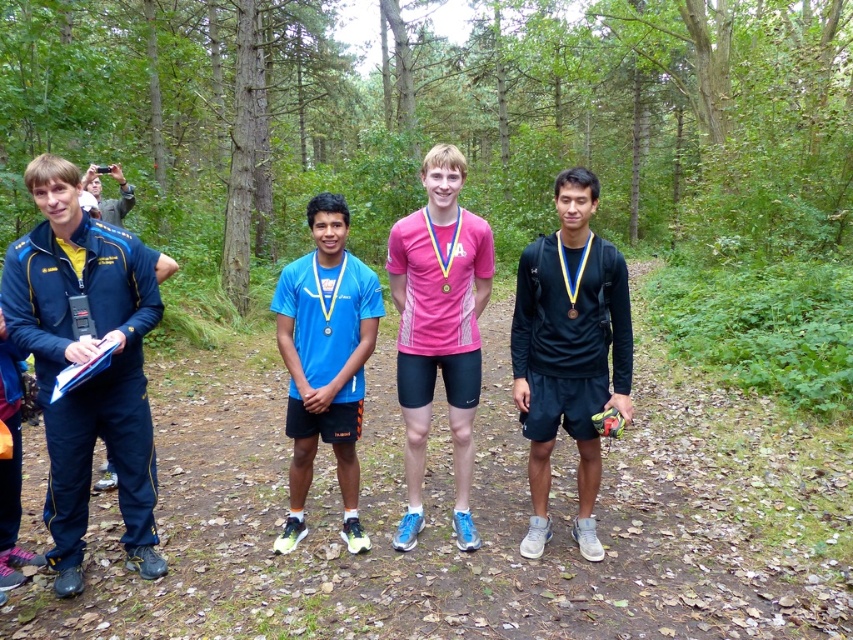
You are a photographer positioned at the origin point of the forest trail scene. You need to capture a photo that includes the blue fabric jacket at left. Where should you aim your camera based on the coordinates provided?

The blue fabric jacket at left is located at coordinates point (84, 362), so you should aim your camera towards that point to include it in the photo.

In the scene shown: You are a photographer trying to capture a clear shot of the black matte shirt at center and the matte black jacket at left. Since both are black, you need to adjust your camera settings to distinguish them. Which object should you focus on first to ensure proper exposure, considering their sizes?

The black matte shirt at center is larger in size than the matte black jacket at left, so focusing on the larger black matte shirt at center first will help adjust exposure settings more effectively.

Where is the blue fabric jacket at left located in the image?

The blue fabric jacket at left is located at point (84, 362) in the image.